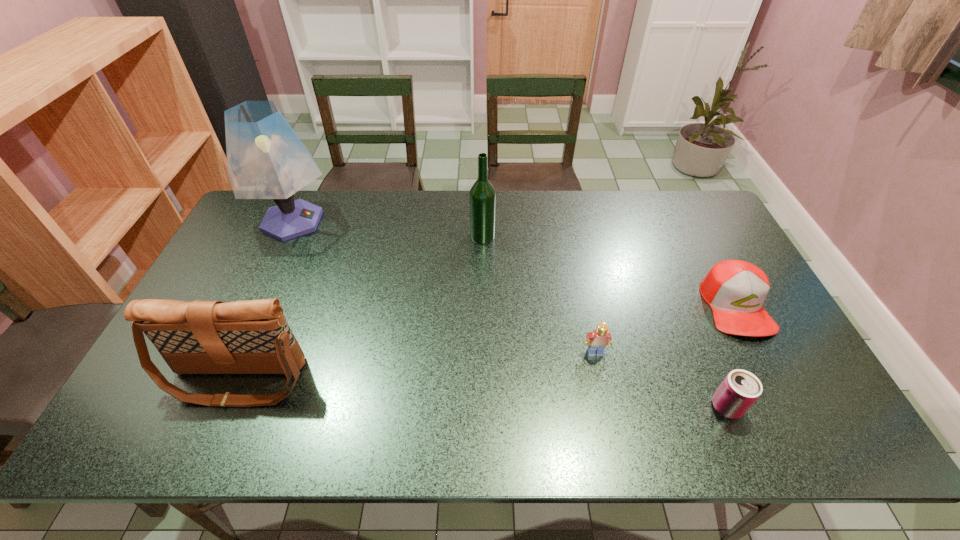
Where is `object that is positioned at the far left corner`? This screenshot has height=540, width=960. object that is positioned at the far left corner is located at coordinates (266, 159).

In the image, there is a desktop. In order to click on vacant space at the far edge in this screenshot , I will do 408,212.

Locate an element on the screen. Image resolution: width=960 pixels, height=540 pixels. vacant space at the left edge of the desktop is located at coordinates (265, 241).

Find the location of a particular element. The height and width of the screenshot is (540, 960). free space at the right edge is located at coordinates (792, 374).

Where is `free space at the far right corner`? free space at the far right corner is located at coordinates (695, 221).

Where is `free spot between the third farthest object and the fourth object from right to left`? The image size is (960, 540). free spot between the third farthest object and the fourth object from right to left is located at coordinates (609, 271).

Where is `free space between the tallest object and the alcohol`? The image size is (960, 540). free space between the tallest object and the alcohol is located at coordinates (388, 228).

I want to click on unoccupied area between the fifth object from left to right and the third tallest object, so [482, 394].

Identify the location of vacant area that lies between the fourth object from left to right and the second object from right to left. (660, 380).

The image size is (960, 540). In order to click on blank region between the third farthest object and the fifth object from left to right in this screenshot , I will do `click(731, 356)`.